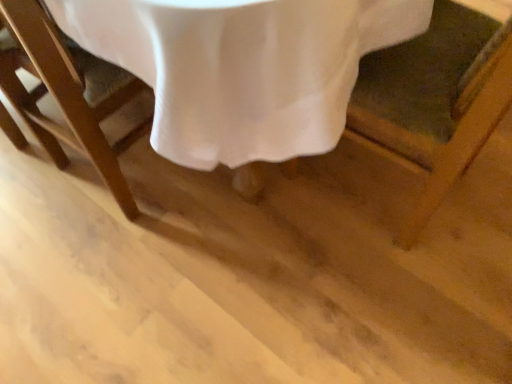
The height and width of the screenshot is (384, 512). I want to click on vacant area in front of wooden chair at lower right, so 390,299.